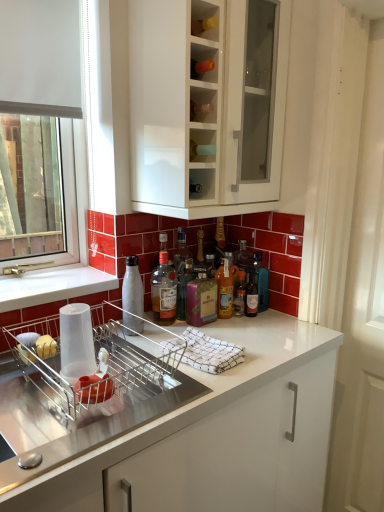
Question: In which direction should I rotate to look at white matte bottle at sink, placed as the 1th bottle when sorted from left to right?

Choices:
 (A) right
 (B) left

Answer: (B)

Question: Does transparent plastic cup at sink come behind translucent glass bottle at center, marked as the fifth bottle in a left-to-right arrangement?

Choices:
 (A) no
 (B) yes

Answer: (A)

Question: Is transparent plastic cup at sink closer to camera compared to translucent glass bottle at center, marked as the fifth bottle in a left-to-right arrangement?

Choices:
 (A) no
 (B) yes

Answer: (B)

Question: Considering the relative positions of transparent plastic cup at sink and translucent glass bottle at center, marked as the fifth bottle in a left-to-right arrangement, in the image provided, is transparent plastic cup at sink to the right of translucent glass bottle at center, marked as the fifth bottle in a left-to-right arrangement, from the viewer's perspective?

Choices:
 (A) no
 (B) yes

Answer: (A)

Question: Considering the relative sizes of transparent plastic cup at sink and translucent glass bottle at center, marked as the fifth bottle in a left-to-right arrangement, in the image provided, is transparent plastic cup at sink smaller than translucent glass bottle at center, marked as the fifth bottle in a left-to-right arrangement,?

Choices:
 (A) yes
 (B) no

Answer: (B)

Question: Is transparent plastic cup at sink outside translucent glass bottle at center, arranged as the second bottle when viewed from the right?

Choices:
 (A) no
 (B) yes

Answer: (B)

Question: Does transparent plastic cup at sink have a greater height compared to translucent glass bottle at center, arranged as the second bottle when viewed from the right?

Choices:
 (A) yes
 (B) no

Answer: (A)

Question: From a real-world perspective, is white textured screen door at right physically below white matte bottle at sink, the sixth bottle from the right?

Choices:
 (A) yes
 (B) no

Answer: (A)

Question: Can you confirm if white textured screen door at right is positioned to the right of white matte bottle at sink, the sixth bottle from the right?

Choices:
 (A) yes
 (B) no

Answer: (A)

Question: Is white textured screen door at right placed right next to white matte bottle at sink, the sixth bottle from the right?

Choices:
 (A) yes
 (B) no

Answer: (B)

Question: Is white matte bottle at sink, the sixth bottle from the right, at the back of white textured screen door at right?

Choices:
 (A) no
 (B) yes

Answer: (A)

Question: Does white textured screen door at right have a larger size compared to white matte bottle at sink, placed as the 1th bottle when sorted from left to right?

Choices:
 (A) yes
 (B) no

Answer: (A)

Question: Does white textured screen door at right have a lesser width compared to white matte bottle at sink, the sixth bottle from the right?

Choices:
 (A) no
 (B) yes

Answer: (B)

Question: Does translucent glass bottle at center, marked as the 6th bottle in a left-to-right arrangement, have a larger size compared to white glossy cabinet at upper center?

Choices:
 (A) yes
 (B) no

Answer: (B)